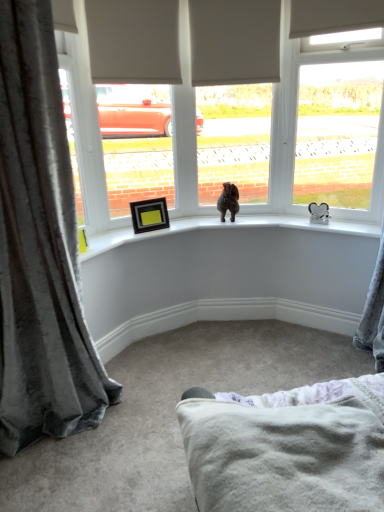
Question: Is white plastic window at upper right located within velvet gray curtain at left?

Choices:
 (A) yes
 (B) no

Answer: (B)

Question: Considering the relative sizes of velvet gray curtain at left and white plastic window at upper right in the image provided, is velvet gray curtain at left thinner than white plastic window at upper right?

Choices:
 (A) no
 (B) yes

Answer: (A)

Question: Could you tell me if velvet gray curtain at left is turned towards white plastic window at upper right?

Choices:
 (A) yes
 (B) no

Answer: (B)

Question: Is velvet gray curtain at left facing away from white plastic window at upper right?

Choices:
 (A) no
 (B) yes

Answer: (A)

Question: Is the position of velvet gray curtain at left more distant than that of white plastic window at upper right?

Choices:
 (A) no
 (B) yes

Answer: (A)

Question: Looking at their shapes, would you say soft white fleece blanket at lower center is wider or thinner than velvet gray curtain at left?

Choices:
 (A) wide
 (B) thin

Answer: (A)

Question: Is point (377, 437) positioned closer to the camera than point (4, 303)?

Choices:
 (A) closer
 (B) farther

Answer: (A)

Question: Based on their sizes in the image, would you say soft white fleece blanket at lower center is bigger or smaller than velvet gray curtain at left?

Choices:
 (A) big
 (B) small

Answer: (B)

Question: From a real-world perspective, is soft white fleece blanket at lower center positioned above or below velvet gray curtain at left?

Choices:
 (A) above
 (B) below

Answer: (B)

Question: Would you say velvet gray curtain at left is inside or outside brown plush bear at center?

Choices:
 (A) outside
 (B) inside

Answer: (A)

Question: In the image, is velvet gray curtain at left positioned in front of or behind brown plush bear at center?

Choices:
 (A) front
 (B) behind

Answer: (A)

Question: From a real-world perspective, relative to brown plush bear at center, is velvet gray curtain at left vertically above or below?

Choices:
 (A) above
 (B) below

Answer: (A)

Question: Considering the positions of velvet gray curtain at left and brown plush bear at center in the image, is velvet gray curtain at left bigger or smaller than brown plush bear at center?

Choices:
 (A) small
 (B) big

Answer: (B)

Question: From the image's perspective, is white plastic window at upper right located above or below velvet gray curtain at left?

Choices:
 (A) below
 (B) above

Answer: (B)

Question: Considering the relative positions of white plastic window at upper right and velvet gray curtain at left in the image provided, is white plastic window at upper right to the left or to the right of velvet gray curtain at left?

Choices:
 (A) right
 (B) left

Answer: (A)